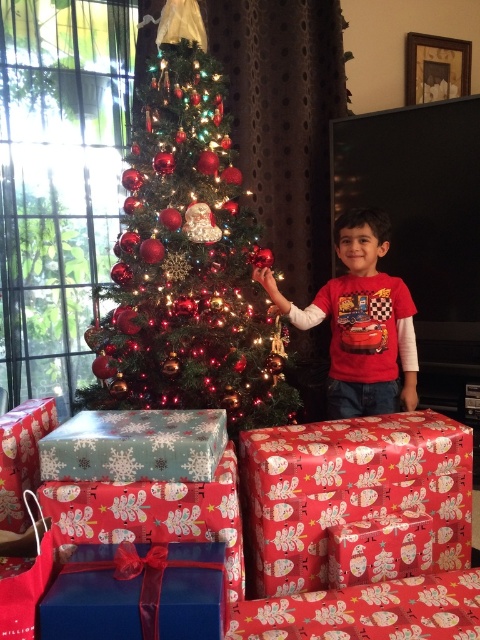
Question: Estimate the real-world distances between objects in this image. Which object is farther from the red wrapping paper gift at center?

Choices:
 (A) shiny green christmas tree at center
 (B) red matte shirt at center

Answer: (A)

Question: Is red wrapping paper gift at center below red matte shirt at center?

Choices:
 (A) no
 (B) yes

Answer: (B)

Question: From the image, what is the correct spatial relationship of shiny green christmas tree at center in relation to red matte shirt at center?

Choices:
 (A) below
 (B) above

Answer: (B)

Question: Does shiny green christmas tree at center appear over red wrapping paper gift at center?

Choices:
 (A) no
 (B) yes

Answer: (B)

Question: Which point is farther to the camera?

Choices:
 (A) pos(360,260)
 (B) pos(205,209)
 (C) pos(454,484)

Answer: (A)

Question: Estimate the real-world distances between objects in this image. Which object is closer to the shiny green christmas tree at center?

Choices:
 (A) red wrapping paper gift at center
 (B) red matte shirt at center

Answer: (B)